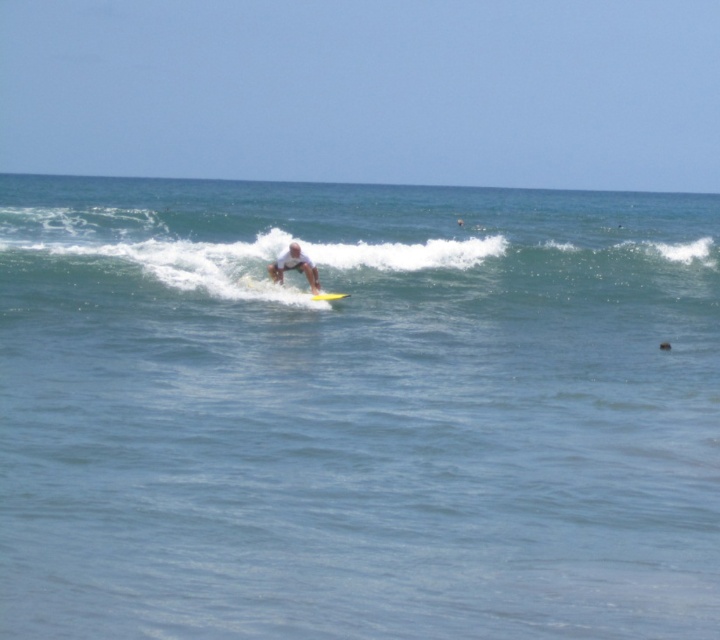
Can you confirm if white matte surfboard at center is positioned below yellow foam surfboard at center?

Actually, white matte surfboard at center is above yellow foam surfboard at center.

Is point (276, 260) positioned in front of point (328, 298)?

No, (276, 260) is behind (328, 298).

Locate an element on the screen. white matte surfboard at center is located at coordinates (294, 266).

Describe the element at coordinates (356, 412) in the screenshot. I see `clear blue water at center` at that location.

In order to click on clear blue water at center in this screenshot , I will do `click(356, 412)`.

Locate an element on the screen. The image size is (720, 640). clear blue water at center is located at coordinates (356, 412).

Based on the photo, between clear blue water at center and white matte surfboard at center, which one has more height?

Standing taller between the two is clear blue water at center.

Between clear blue water at center and white matte surfboard at center, which one appears on the left side from the viewer's perspective?

Positioned to the left is white matte surfboard at center.

Is point (469, 234) closer to viewer compared to point (307, 262)?

No, (469, 234) is further to viewer.

You are a GUI agent. You are given a task and a screenshot of the screen. Output one action in this format:
    pyautogui.click(x=<x>, y=<y>)
    Task: Click on the clear blue water at center
    
    Given the screenshot: What is the action you would take?
    pyautogui.click(x=356, y=412)